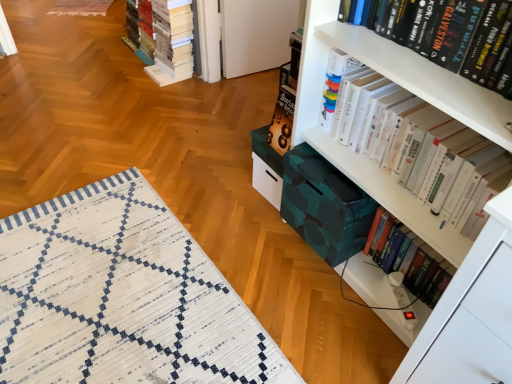
Identify the location of free location in front of white paper book at upper left, the 1th book positioned from the left. The image size is (512, 384). (132, 99).